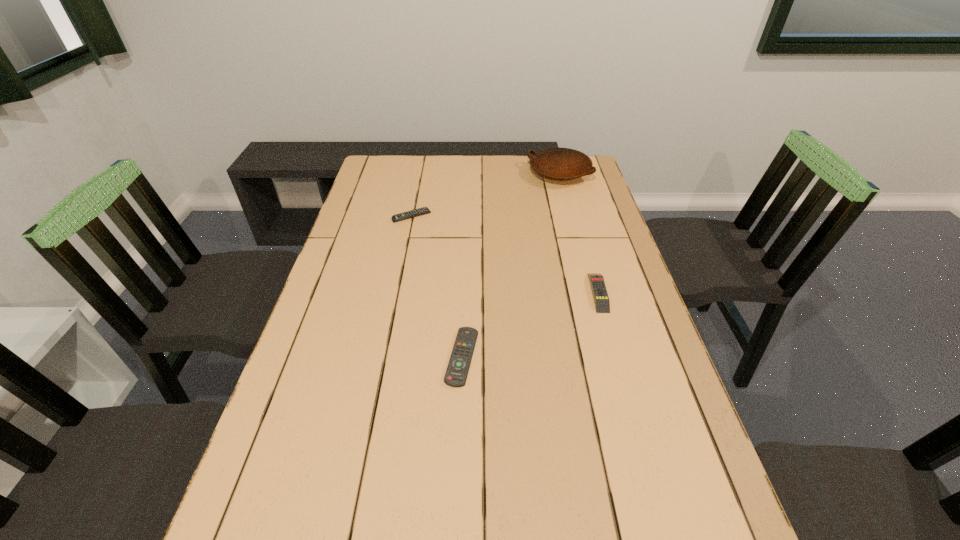
You are a GUI agent. You are given a task and a screenshot of the screen. Output one action in this format:
    pyautogui.click(x=<x>, y=<y>)
    Task: Click on the free space that is in between the leftmost object and the second nearest object
    This screenshot has width=960, height=540.
    Given the screenshot: What is the action you would take?
    pyautogui.click(x=505, y=254)

The image size is (960, 540). Find the location of `free space between the second nearest remote control and the second farthest object`. free space between the second nearest remote control and the second farthest object is located at coordinates (505, 254).

Image resolution: width=960 pixels, height=540 pixels. I want to click on unoccupied area between the tallest object and the second object from left to right, so click(x=511, y=265).

You are a GUI agent. You are given a task and a screenshot of the screen. Output one action in this format:
    pyautogui.click(x=<x>, y=<y>)
    Task: Click on the free space between the second remote control from left to right and the tallest object
    Image resolution: width=960 pixels, height=540 pixels.
    Given the screenshot: What is the action you would take?
    pyautogui.click(x=511, y=265)

At what (x,y) coordinates should I click in order to perform the action: click on vacant area between the leftmost object and the tallest object. Please return your answer as a coordinate pair (x, y). Image resolution: width=960 pixels, height=540 pixels. Looking at the image, I should click on (486, 195).

Find the location of a particular element. free spot between the leftmost object and the second remote control from left to right is located at coordinates (437, 287).

In order to click on empty location between the farthest object and the tallest remote control in this screenshot , I will do `click(579, 233)`.

I want to click on free space between the tallest remote control and the nearest object, so click(530, 325).

Locate an element on the screen. The height and width of the screenshot is (540, 960). empty location between the farthest remote control and the farthest object is located at coordinates (486, 195).

At what (x,y) coordinates should I click in order to perform the action: click on free space between the tallest object and the second nearest object. Please return your answer as a coordinate pair (x, y). The height and width of the screenshot is (540, 960). Looking at the image, I should click on (579, 233).